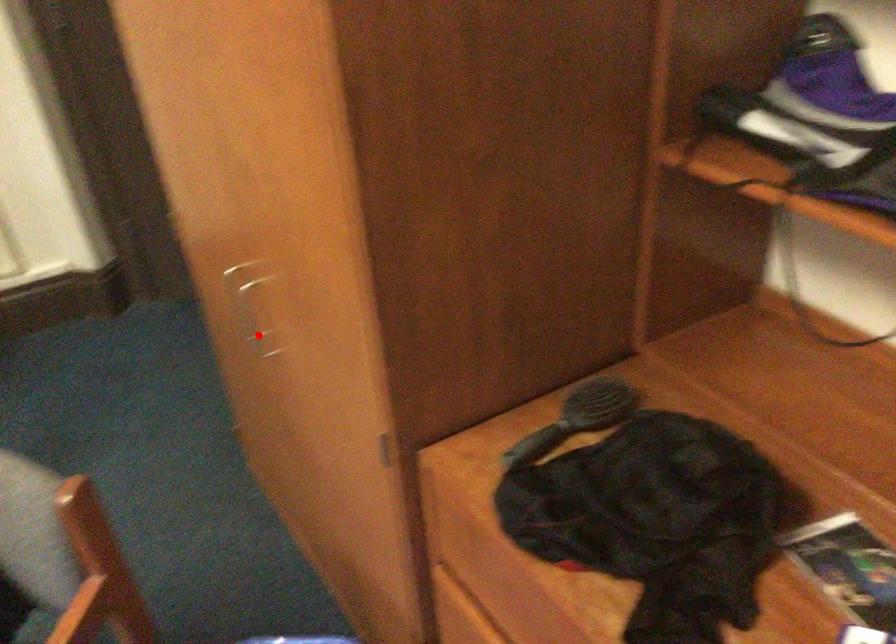
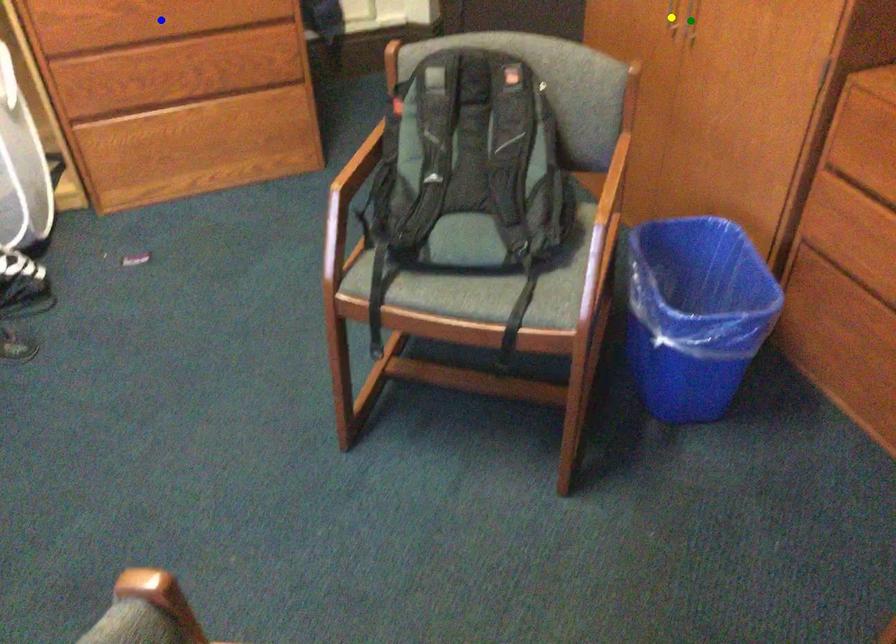
Question: I am providing you with two images of the same scene from different viewpoints. A red point is marked on the first image. You are given multiple points on the second image. In image 2, which mark is for the same physical point as the one in image 1?

Choices:
 (A) blue point
 (B) yellow point
 (C) green point

Answer: (C)